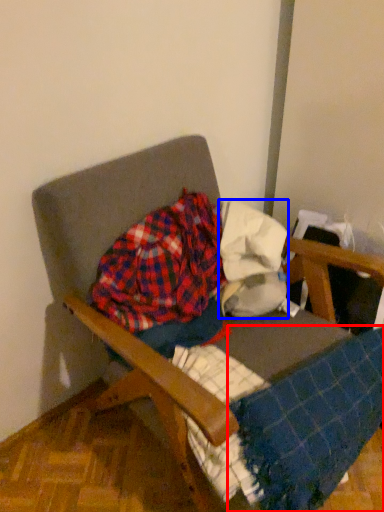
Question: Which of the following is the farthest to the observer, blanket (highlighted by a red box) or fabric (highlighted by a blue box)?

Choices:
 (A) blanket
 (B) fabric

Answer: (B)